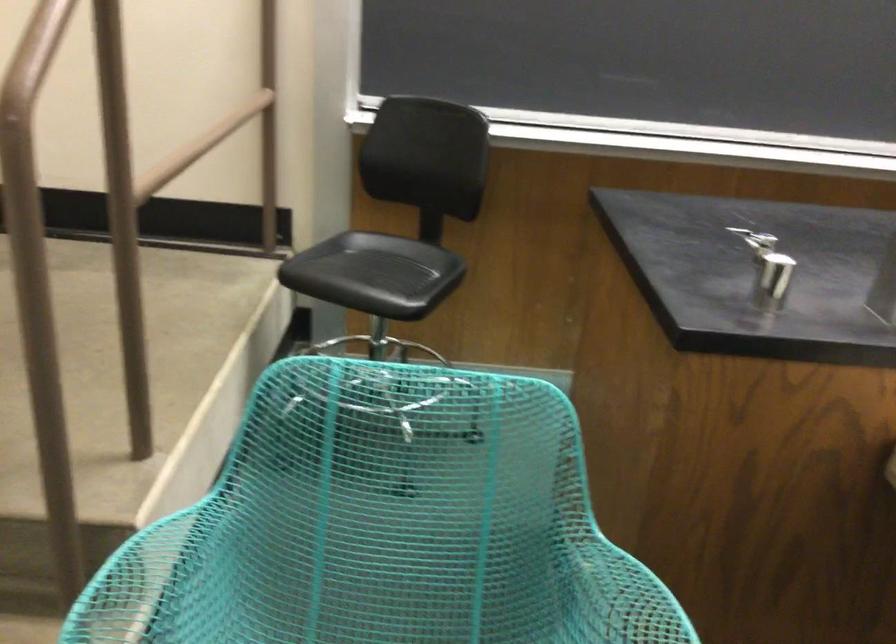
The location [768,269] corresponds to which object?

It refers to a metal lab clamp.